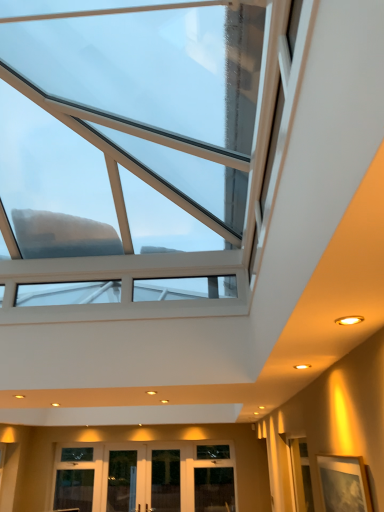
Question: Can you confirm if transparent glass door at center, the 1th glass door positioned from the right, is wider than clear glass door at center, the 2th glass door from the left?

Choices:
 (A) yes
 (B) no

Answer: (A)

Question: Is transparent glass door at center, the 1th glass door positioned from the right, behind clear glass door at center, the 2th glass door in the right-to-left sequence?

Choices:
 (A) no
 (B) yes

Answer: (A)

Question: Can you confirm if transparent glass door at center, the 1th glass door positioned from the right, is positioned to the right of clear glass door at center, the 2th glass door from the left?

Choices:
 (A) no
 (B) yes

Answer: (B)

Question: Is transparent glass door at center, the 3th glass door when ordered from left to right, positioned with its back to clear glass door at center, the 2th glass door from the left?

Choices:
 (A) yes
 (B) no

Answer: (A)

Question: Can you confirm if transparent glass door at center, the 1th glass door positioned from the right, is taller than clear glass door at center, the 2th glass door from the left?

Choices:
 (A) yes
 (B) no

Answer: (B)

Question: Is clear glass door at center, the 2th glass door from the left, completely or partially inside transparent glass door at center, the 1th glass door positioned from the right?

Choices:
 (A) yes
 (B) no

Answer: (A)

Question: Is the position of transparent glass door at lower center, the 3th glass door positioned from the right, less distant than that of clear glass door at center, the 2th glass door in the right-to-left sequence?

Choices:
 (A) no
 (B) yes

Answer: (A)

Question: Can you confirm if transparent glass door at lower center, placed as the first glass door when sorted from left to right, is positioned to the right of clear glass door at center, the 2th glass door in the right-to-left sequence?

Choices:
 (A) yes
 (B) no

Answer: (B)

Question: From a real-world perspective, is transparent glass door at lower center, placed as the first glass door when sorted from left to right, beneath clear glass door at center, the 2th glass door in the right-to-left sequence?

Choices:
 (A) no
 (B) yes

Answer: (A)

Question: Is the depth of transparent glass door at lower center, placed as the first glass door when sorted from left to right, greater than that of clear glass door at center, the 2th glass door from the left?

Choices:
 (A) yes
 (B) no

Answer: (A)

Question: Is transparent glass door at lower center, the 3th glass door positioned from the right, beside clear glass door at center, the 2th glass door in the right-to-left sequence?

Choices:
 (A) yes
 (B) no

Answer: (B)

Question: From the image's perspective, is transparent glass door at lower center, placed as the first glass door when sorted from left to right, beneath clear glass door at center, the 2th glass door in the right-to-left sequence?

Choices:
 (A) yes
 (B) no

Answer: (A)

Question: Is transparent glass skylight at upper center at the left side of transparent glass door at center, the 1th glass door positioned from the right?

Choices:
 (A) no
 (B) yes

Answer: (B)